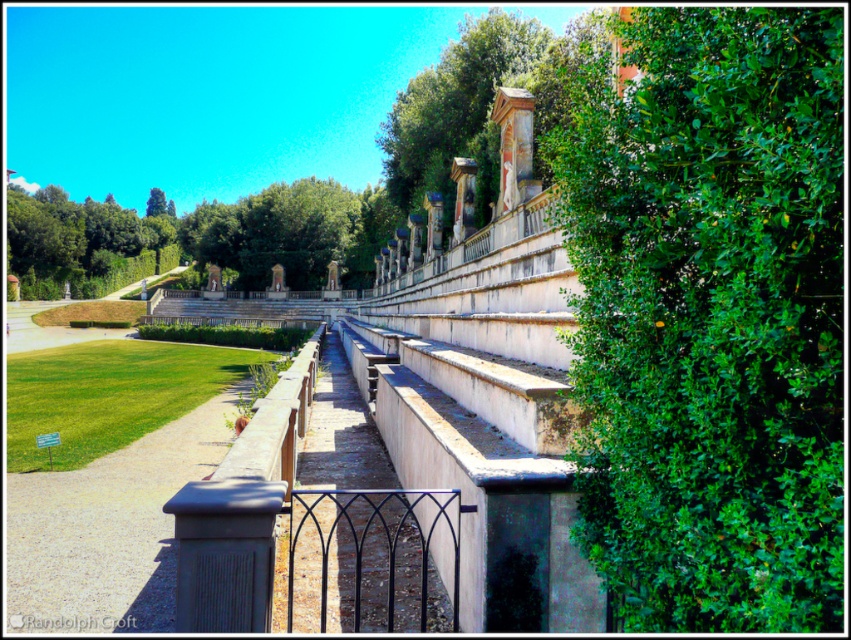
Who is positioned more to the right, green leafy bush at right or black wrought iron fence at center?

green leafy bush at right is more to the right.

Does point (728, 340) lie in front of point (309, 499)?

Yes, it is in front of point (309, 499).

At what (x,y) coordinates should I click in order to perform the action: click on green leafy bush at right. Please return your answer as a coordinate pair (x, y). The height and width of the screenshot is (640, 851). Looking at the image, I should click on (710, 316).

Is point (661, 598) in front of point (407, 211)?

Yes.

Who is more forward, (x=704, y=84) or (x=452, y=196)?

Point (x=704, y=84)

Is point (754, 502) less distant than point (415, 179)?

Yes, point (754, 502) is in front of point (415, 179).

Find the location of a particular element. This screenshot has height=640, width=851. green leafy bush at right is located at coordinates (710, 316).

Between green leafy bush at right and gray concrete path at lower left, which one has more height?

green leafy bush at right

Identify the location of green leafy bush at right. The height and width of the screenshot is (640, 851). pos(710,316).

The height and width of the screenshot is (640, 851). Identify the location of green leafy bush at right. (710, 316).

Identify the location of green leafy bush at right. (710, 316).